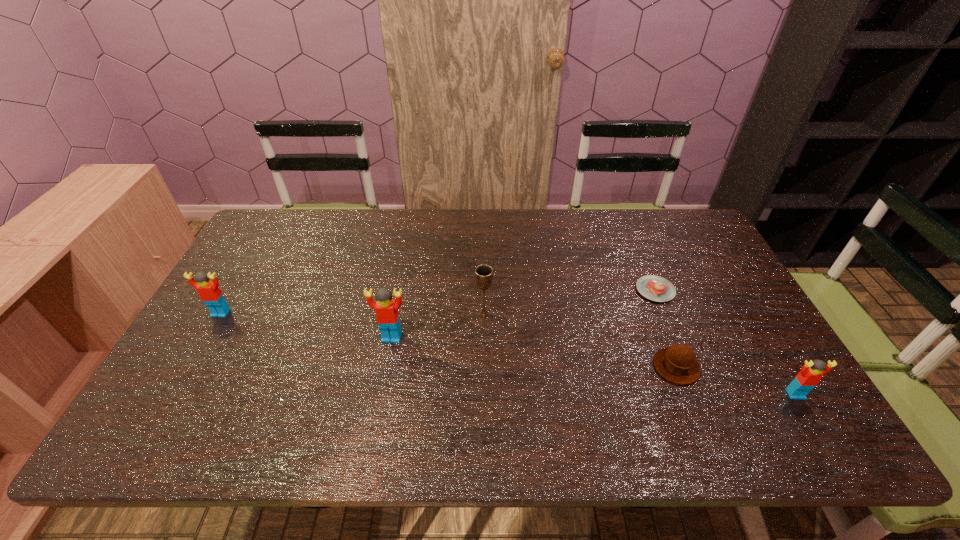
Where is `the fourth object from right to left`? This screenshot has width=960, height=540. the fourth object from right to left is located at coordinates (484, 273).

The width and height of the screenshot is (960, 540). I want to click on vacant point located on the face of the farthest Lego, so click(171, 400).

I want to click on free point located 0.050m on the face of the second nearest Lego, so click(388, 359).

What are the coordinates of `free space located on the front of the farthest object` in the screenshot? It's located at (703, 407).

The width and height of the screenshot is (960, 540). What are the coordinates of `free space located on the left of the second nearest object` in the screenshot? It's located at (554, 367).

Find the location of a particular element. The image size is (960, 540). vacant area situated 0.150m on the front of the chalice is located at coordinates (484, 366).

You are a GUI agent. You are given a task and a screenshot of the screen. Output one action in this format:
    pyautogui.click(x=<x>, y=<y>)
    Task: Click on the Lego that is at the near edge
    This screenshot has width=960, height=540.
    Given the screenshot: What is the action you would take?
    pyautogui.click(x=811, y=373)

Find the location of a particular element. This screenshot has height=540, width=960. muffin present at the near edge is located at coordinates (678, 364).

Where is `object at the left edge`? object at the left edge is located at coordinates (209, 292).

Find the location of a particular element. Image resolution: width=960 pixels, height=540 pixels. object that is positioned at the right edge is located at coordinates pyautogui.click(x=811, y=373).